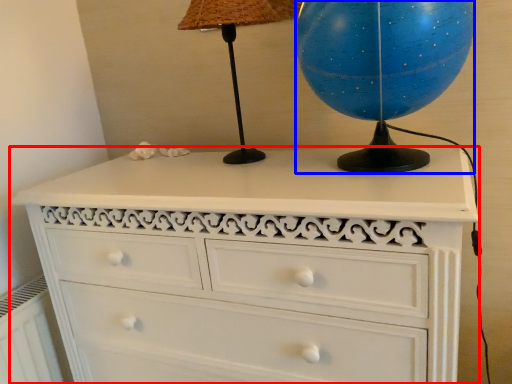
Question: Which object appears closest to the camera in this image, chest of drawers (highlighted by a red box) or sphere (highlighted by a blue box)?

Choices:
 (A) chest of drawers
 (B) sphere

Answer: (A)